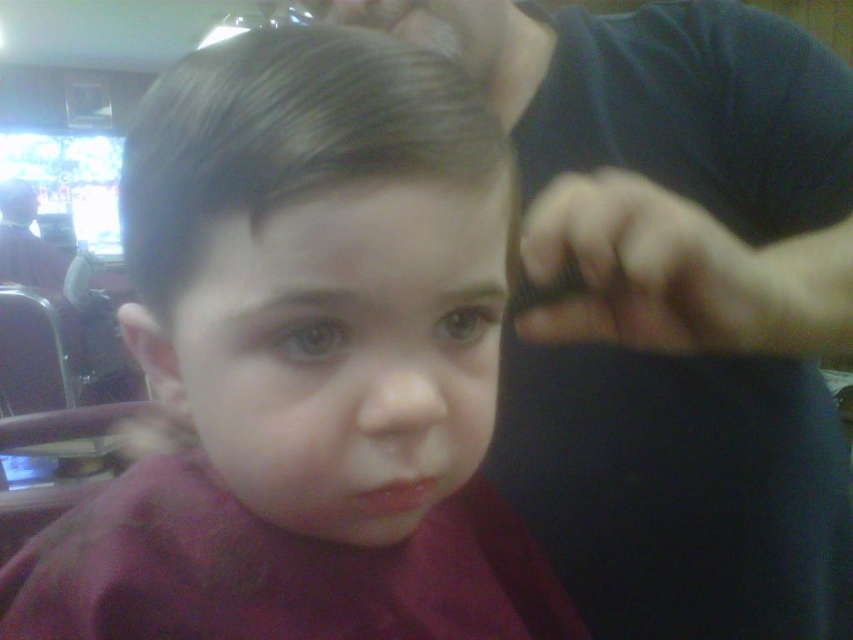
Question: Does matte black hair at center appear on the right side of dark blue shirt at upper right?

Choices:
 (A) no
 (B) yes

Answer: (A)

Question: Which point is closer to the camera taking this photo?

Choices:
 (A) pyautogui.click(x=560, y=64)
 (B) pyautogui.click(x=409, y=627)

Answer: (B)

Question: Where is matte black hair at center located in relation to dark blue shirt at upper right in the image?

Choices:
 (A) right
 (B) left

Answer: (B)

Question: Is matte black hair at center below dark blue shirt at upper right?

Choices:
 (A) no
 (B) yes

Answer: (B)